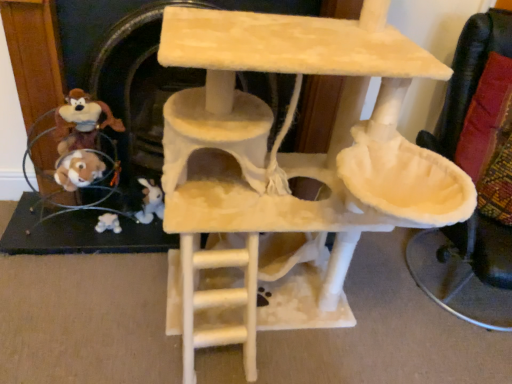
At what (x,y) coordinates should I click in order to perform the action: click on free space between white plush toy at lower left, which is the second toy in front-to-back order, and beige felt cat tree at center. Please return your answer as a coordinate pair (x, y). Looking at the image, I should click on (140, 295).